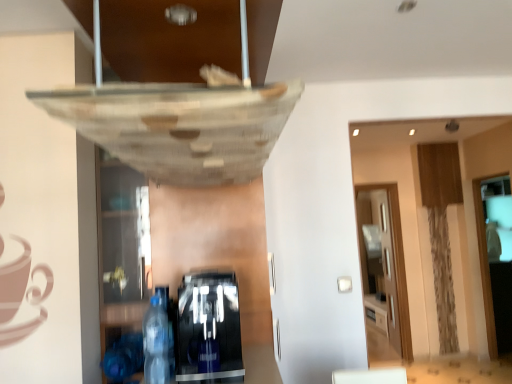
Question: From a real-world perspective, relative to transparent glass door at right, the first glass door when ordered from right to left, is black glossy coffee machine at lower center, the first shelf when ordered from right to left, vertically above or below?

Choices:
 (A) below
 (B) above

Answer: (B)

Question: Is point (200, 266) closer or farther from the camera than point (488, 276)?

Choices:
 (A) closer
 (B) farther

Answer: (A)

Question: Which of these objects is positioned farthest from the black glossy coffee machine at lower center, the first shelf when ordered from right to left?

Choices:
 (A) transparent glass door at right, the first glass door when ordered from right to left
 (B) transparent wood glass door at right, placed as the 2th glass door when sorted from front to back
 (C) transparent glass shelf at lower left, which is the second shelf in right-to-left order
 (D) transparent plastic bottle at lower left

Answer: (B)

Question: Which object is positioned closest to the transparent glass shelf at lower left, which is the second shelf in right-to-left order?

Choices:
 (A) transparent glass door at right, which ranks as the second glass door in left-to-right order
 (B) transparent plastic bottle at lower left
 (C) black glossy coffee machine at lower center, the first shelf when ordered from right to left
 (D) transparent wood glass door at right, placed as the 2th glass door when sorted from front to back

Answer: (C)